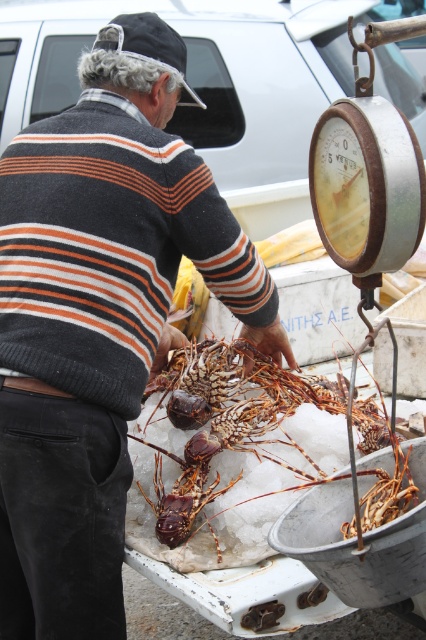
Which of these two, striped sweater at center or shiny orange lobster at center, stands shorter?

With less height is shiny orange lobster at center.

This screenshot has height=640, width=426. Describe the element at coordinates (98, 317) in the screenshot. I see `striped sweater at center` at that location.

Locate an element on the screen. Image resolution: width=426 pixels, height=640 pixels. striped sweater at center is located at coordinates coord(98,317).

You are a GUI agent. You are given a task and a screenshot of the screen. Output one action in this format:
    pyautogui.click(x=<x>, y=<y>)
    Task: Click on the striped sweater at center
    
    Given the screenshot: What is the action you would take?
    pyautogui.click(x=98, y=317)